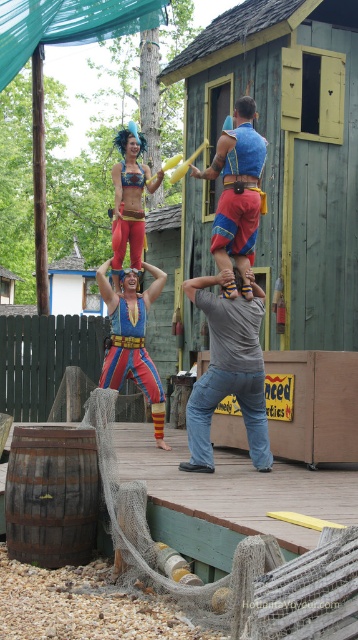
Question: Estimate the real-world distances between objects in this image. Which object is closer to the blue fabric at center?

Choices:
 (A) shiny blue bikini top at center
 (B) gray cotton shirt at center
 (C) matte multicolored costume at center
 (D) shiny metallic bikini top at upper center

Answer: (B)

Question: Does blue fabric at center have a greater width compared to shiny blue bikini top at center?

Choices:
 (A) no
 (B) yes

Answer: (B)

Question: Can you confirm if gray cotton shirt at center is positioned above blue fabric at center?

Choices:
 (A) yes
 (B) no

Answer: (B)

Question: Which of the following is the farthest from the observer?

Choices:
 (A) gray cotton shirt at center
 (B) blue fabric at center
 (C) shiny blue bikini top at center

Answer: (C)

Question: Does blue fabric at center come behind shiny blue bikini top at center?

Choices:
 (A) no
 (B) yes

Answer: (A)

Question: Which of the following is the closest to the observer?

Choices:
 (A) pyautogui.click(x=138, y=227)
 (B) pyautogui.click(x=158, y=406)
 (C) pyautogui.click(x=139, y=170)
 (D) pyautogui.click(x=221, y=262)

Answer: (D)